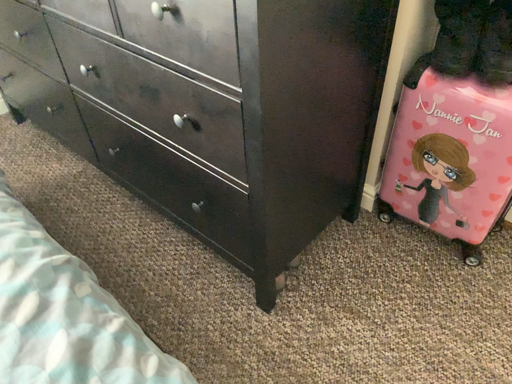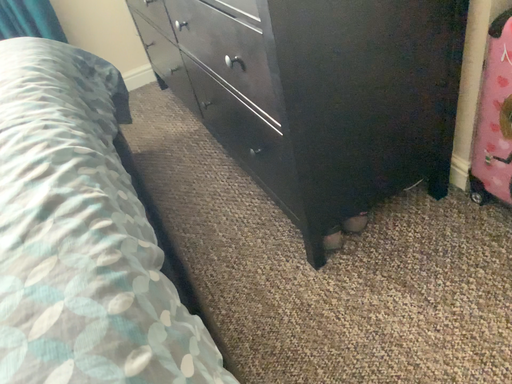
Question: How did the camera likely rotate when shooting the video?

Choices:
 (A) rotated right
 (B) rotated left

Answer: (B)